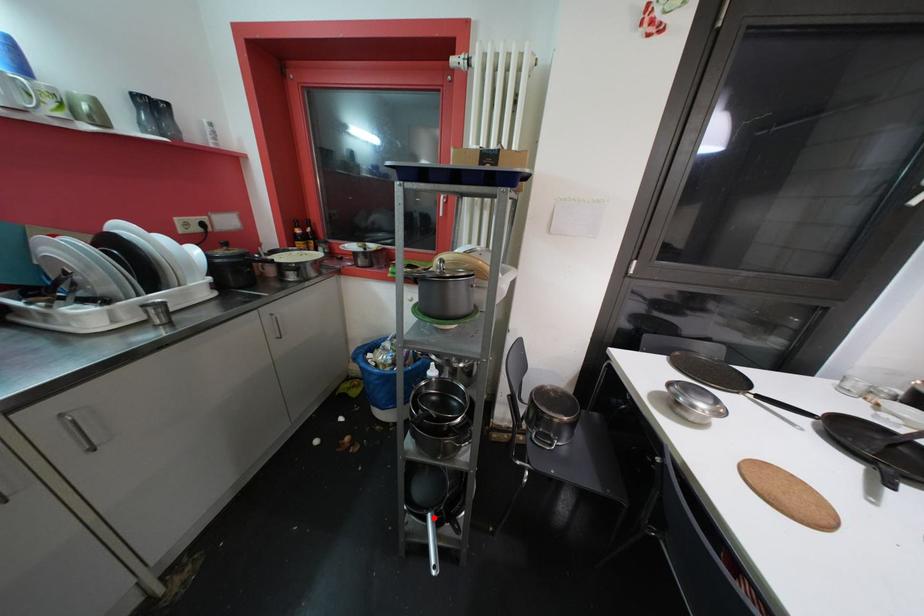
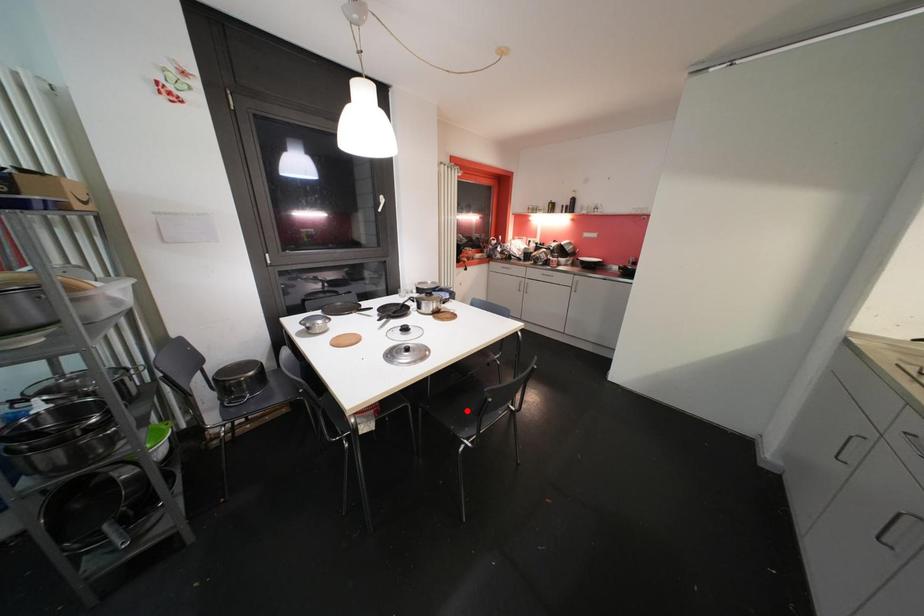
I am providing you with two images of the same scene from different viewpoints. A red point is marked on the first image and another point is marked on the second image. Are the points marked in image1 and image2 representing the same 3D position?

No